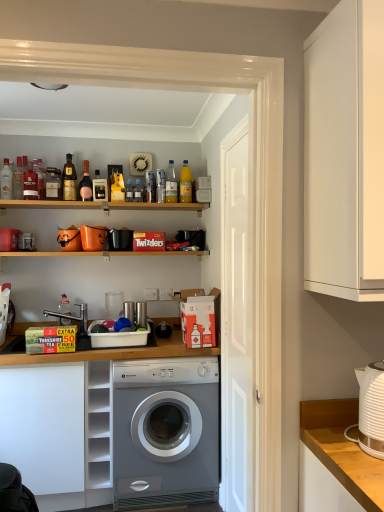
Question: Is the depth of yellow cardboard box at lower left greater than that of yellow matte bottle at upper center, which ranks as the 2th bottle in right-to-left order?

Choices:
 (A) no
 (B) yes

Answer: (A)

Question: Considering the relative sizes of yellow cardboard box at lower left and yellow matte bottle at upper center, which ranks as the 2th bottle in right-to-left order, in the image provided, is yellow cardboard box at lower left taller than yellow matte bottle at upper center, which ranks as the 2th bottle in right-to-left order,?

Choices:
 (A) no
 (B) yes

Answer: (B)

Question: Considering the relative sizes of yellow cardboard box at lower left and yellow matte bottle at upper center, which ranks as the 2th bottle in right-to-left order, in the image provided, is yellow cardboard box at lower left shorter than yellow matte bottle at upper center, which ranks as the 2th bottle in right-to-left order,?

Choices:
 (A) no
 (B) yes

Answer: (A)

Question: Is yellow cardboard box at lower left positioned before yellow matte bottle at upper center, which ranks as the 2th bottle in right-to-left order?

Choices:
 (A) no
 (B) yes

Answer: (B)

Question: From the image's perspective, is yellow cardboard box at lower left beneath yellow matte bottle at upper center, placed as the 8th bottle when sorted from left to right?

Choices:
 (A) no
 (B) yes

Answer: (B)

Question: Is yellow cardboard box at lower left completely or partially outside of yellow matte bottle at upper center, placed as the 8th bottle when sorted from left to right?

Choices:
 (A) no
 (B) yes

Answer: (B)

Question: Does white matte door at center have a greater width compared to white plastic dish rack at center, which is the 4th appliance in top-to-bottom order?

Choices:
 (A) no
 (B) yes

Answer: (A)

Question: Does white matte door at center turn towards white plastic dish rack at center, the second appliance in the front-to-back sequence?

Choices:
 (A) yes
 (B) no

Answer: (B)

Question: Can you see white matte door at center touching white plastic dish rack at center, which is counted as the first appliance, starting from the bottom?

Choices:
 (A) yes
 (B) no

Answer: (B)

Question: Is white matte door at center shorter than white plastic dish rack at center, acting as the second appliance starting from the left?

Choices:
 (A) yes
 (B) no

Answer: (B)

Question: Does white matte door at center lie behind white plastic dish rack at center, which is counted as the first appliance, starting from the bottom?

Choices:
 (A) yes
 (B) no

Answer: (B)

Question: Does white matte door at center appear on the right side of white plastic dish rack at center, which is counted as the first appliance, starting from the bottom?

Choices:
 (A) yes
 (B) no

Answer: (A)

Question: Considering the relative positions of yellow cardboard box at lower left and white plastic dish rack at center, which is the 4th appliance in top-to-bottom order, in the image provided, is yellow cardboard box at lower left to the right of white plastic dish rack at center, which is the 4th appliance in top-to-bottom order, from the viewer's perspective?

Choices:
 (A) yes
 (B) no

Answer: (B)